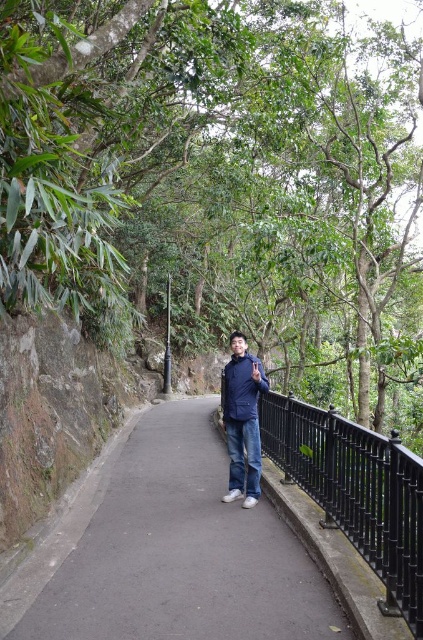
You are a photographer taking a picture of the scene. You notice two points in the image labeled as point (98, 220) and point (379, 608). Which point is closer to the camera?

Point (98, 220) is further to the camera than point (379, 608), so the closer point to the camera is point (379, 608).

You are standing at the point marked by the coordinates point (169,552). Which object are you standing on?

You are standing on the black asphalt path at center.